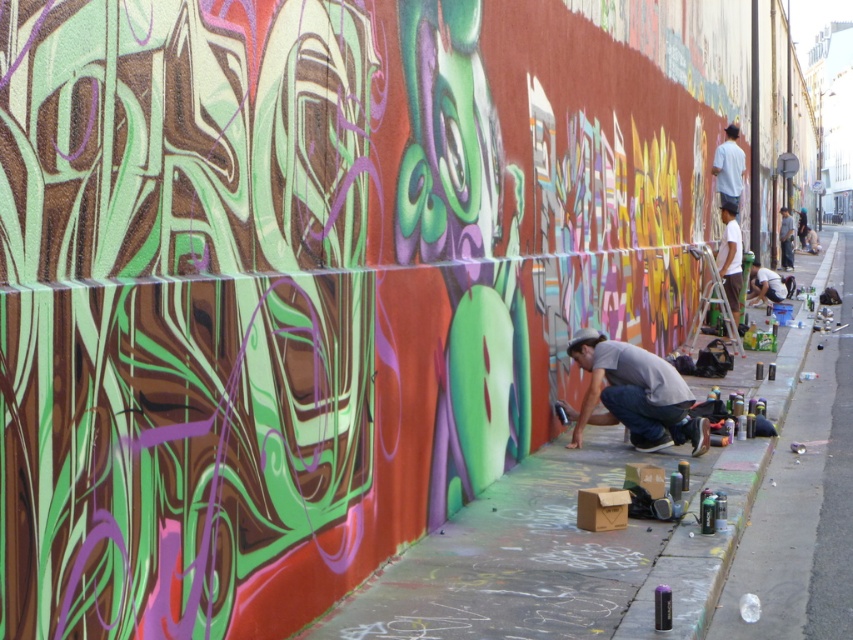
Question: Which point is closer to the camera taking this photo?

Choices:
 (A) (x=755, y=278)
 (B) (x=786, y=413)
 (C) (x=657, y=540)
 (D) (x=595, y=342)

Answer: (C)

Question: Can you confirm if concrete sidewalk at lower right is smaller than gray fabric squat at center?

Choices:
 (A) yes
 (B) no

Answer: (B)

Question: Is concrete sidewalk at lower right positioned behind matte black squat at lower right?

Choices:
 (A) yes
 (B) no

Answer: (B)

Question: Estimate the real-world distances between objects in this image. Which object is closer to the dark gray shirt at lower right?

Choices:
 (A) white cotton shirt at upper right
 (B) gray fabric squat at center
 (C) concrete sidewalk at lower right

Answer: (C)

Question: Which object is farther from the camera taking this photo?

Choices:
 (A) concrete sidewalk at lower right
 (B) matte black squat at lower right
 (C) white matte shirt at upper right

Answer: (B)

Question: Can you confirm if white matte shirt at upper right is positioned to the left of dark gray shirt at lower right?

Choices:
 (A) yes
 (B) no

Answer: (A)